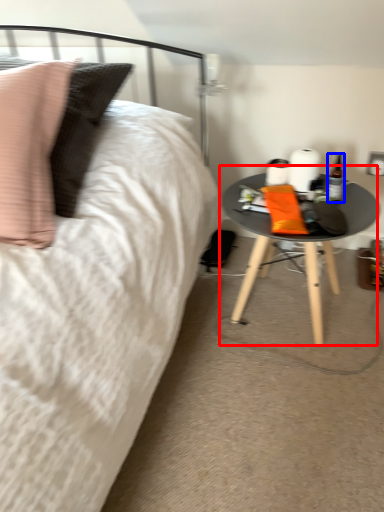
Question: Which point is further to the camera, table (highlighted by a red box) or bottle (highlighted by a blue box)?

Choices:
 (A) table
 (B) bottle

Answer: (B)